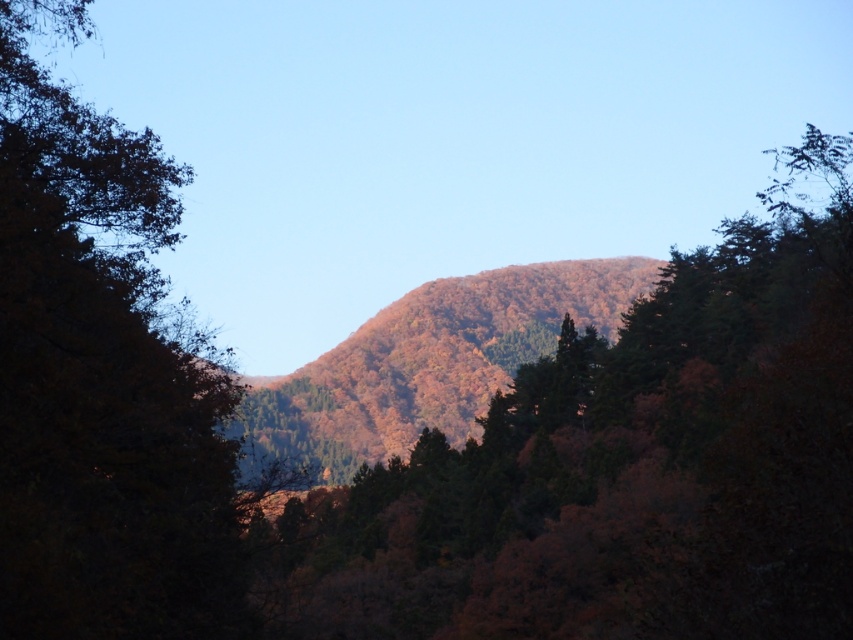
You are planning to place a 50 meter long hiking trail between the autumn leaves at center and the autumn foliage hill at center. Will the trail fit between them?

The distance between the autumn leaves at center and the autumn foliage hill at center is 47.97 meters, so the 50 meter long hiking trail will not fit between them as it is longer than the available space.